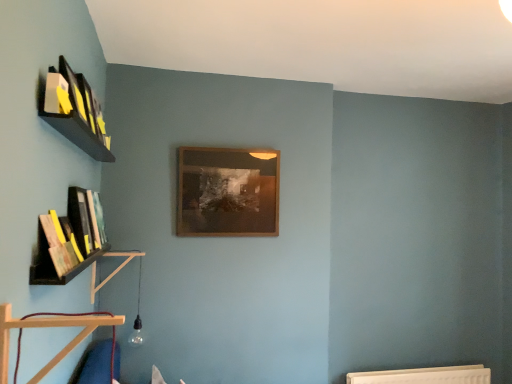
Question: From the image's perspective, is wooden at left, arranged as the first shelf when viewed from the left, located beneath wooden at lower left, acting as the first shelf starting from the front?

Choices:
 (A) no
 (B) yes

Answer: (B)

Question: From the image's perspective, is wooden at left, the first shelf in the back-to-front sequence, on top of wooden at lower left, marked as the first shelf in a right-to-left arrangement?

Choices:
 (A) no
 (B) yes

Answer: (A)

Question: Can you confirm if wooden at left, the first shelf in the back-to-front sequence, is thinner than wooden at lower left, the 2th shelf positioned from the left?

Choices:
 (A) no
 (B) yes

Answer: (B)

Question: Is wooden at left, the second shelf in the right-to-left sequence, directly adjacent to wooden at lower left, marked as the first shelf in a right-to-left arrangement?

Choices:
 (A) no
 (B) yes

Answer: (A)

Question: Is wooden at left, arranged as the first shelf when viewed from the left, at the left side of wooden at lower left, marked as the first shelf in a right-to-left arrangement?

Choices:
 (A) no
 (B) yes

Answer: (B)

Question: Is point (92, 271) positioned closer to the camera than point (103, 243)?

Choices:
 (A) farther
 (B) closer

Answer: (B)

Question: From a real-world perspective, is wooden at left, arranged as the second shelf when viewed from the front, above or below hardcover book at left, which ranks as the 2th book in front-to-back order?

Choices:
 (A) above
 (B) below

Answer: (B)

Question: In the image, is wooden at left, arranged as the first shelf when viewed from the left, positioned in front of or behind hardcover book at left, acting as the 2th book starting from the back?

Choices:
 (A) front
 (B) behind

Answer: (B)

Question: Considering the relative positions of wooden at left, arranged as the first shelf when viewed from the left, and hardcover book at left, the 2th book ordered from the bottom, in the image provided, is wooden at left, arranged as the first shelf when viewed from the left, to the left or to the right of hardcover book at left, the 2th book ordered from the bottom,?

Choices:
 (A) right
 (B) left

Answer: (B)

Question: Is wooden picture frame at center inside the boundaries of wooden at lower left, acting as the first shelf starting from the front, or outside?

Choices:
 (A) outside
 (B) inside

Answer: (A)

Question: From their relative heights in the image, would you say wooden picture frame at center is taller or shorter than wooden at lower left, which is counted as the 2th shelf, starting from the back?

Choices:
 (A) tall
 (B) short

Answer: (A)

Question: From a real-world perspective, is wooden picture frame at center positioned above or below wooden at lower left, acting as the first shelf starting from the front?

Choices:
 (A) above
 (B) below

Answer: (A)

Question: Is wooden picture frame at center bigger or smaller than wooden at lower left, acting as the first shelf starting from the front?

Choices:
 (A) big
 (B) small

Answer: (A)

Question: Is matte yellow book at upper left, which is the third book from back to front, to the left or to the right of wooden at lower left, which is counted as the 2th shelf, starting from the back, in the image?

Choices:
 (A) left
 (B) right

Answer: (A)

Question: Considering the positions of point (64, 87) and point (6, 365), is point (64, 87) closer or farther from the camera than point (6, 365)?

Choices:
 (A) closer
 (B) farther

Answer: (B)